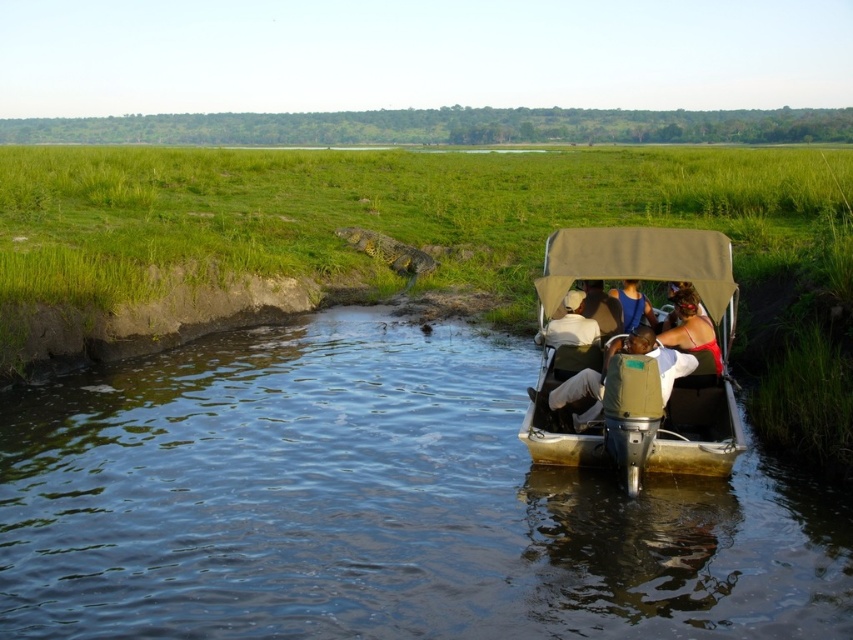
Who is lower down, clear water at lower center or blue fabric shirt at center?

clear water at lower center is lower down.

Image resolution: width=853 pixels, height=640 pixels. What do you see at coordinates (376, 506) in the screenshot? I see `clear water at lower center` at bounding box center [376, 506].

Is point (582, 564) farther from viewer compared to point (640, 296)?

That is False.

At what (x,y) coordinates should I click in order to perform the action: click on clear water at lower center. Please return your answer as a coordinate pair (x, y). Looking at the image, I should click on (376, 506).

Can you confirm if clear water at lower center is positioned to the left of light brown fabric hat at center?

Correct, you'll find clear water at lower center to the left of light brown fabric hat at center.

Does clear water at lower center appear over light brown fabric hat at center?

Actually, clear water at lower center is below light brown fabric hat at center.

Who is more forward, (376, 627) or (593, 323)?

Positioned in front is point (376, 627).

At what (x,y) coordinates should I click in order to perform the action: click on clear water at lower center. Please return your answer as a coordinate pair (x, y). This screenshot has height=640, width=853. Looking at the image, I should click on (376, 506).

What do you see at coordinates (642, 266) in the screenshot?
I see `green canvas boat at center` at bounding box center [642, 266].

Identify the location of green canvas boat at center. (642, 266).